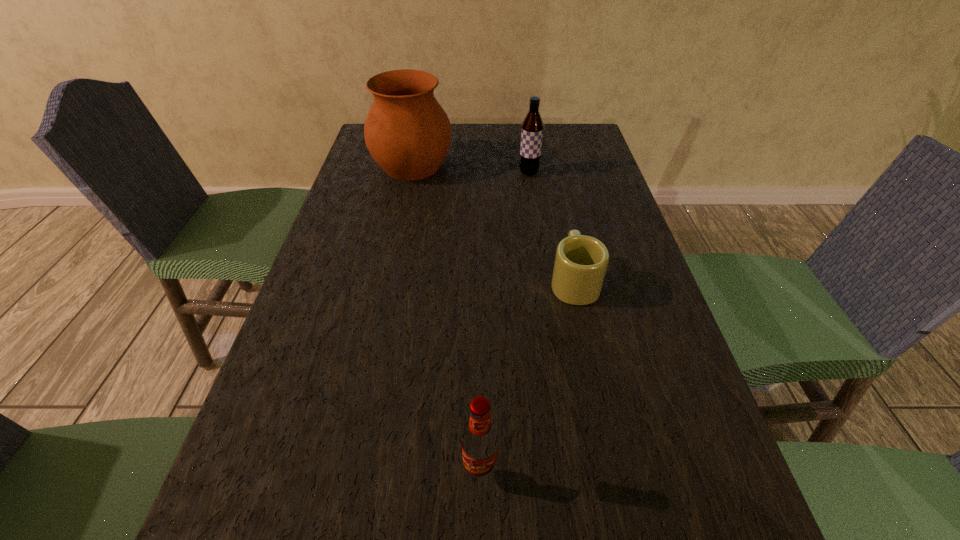
Where is `blank area located 0.050m with the handle on the side of the shortest object`? The image size is (960, 540). blank area located 0.050m with the handle on the side of the shortest object is located at coordinates (566, 245).

Identify the location of blank space located with the handle on the side of the shortest object. The height and width of the screenshot is (540, 960). (561, 220).

Where is `object present at the far edge`? This screenshot has height=540, width=960. object present at the far edge is located at coordinates (407, 132).

This screenshot has height=540, width=960. I want to click on object present at the left edge, so click(x=407, y=132).

Locate an element on the screen. The image size is (960, 540). object that is at the right edge is located at coordinates (581, 261).

Locate an element on the screen. The image size is (960, 540). object that is at the far left corner is located at coordinates (407, 132).

Identify the location of vacant space at the far edge of the desktop. (499, 152).

The height and width of the screenshot is (540, 960). Find the location of `vacant region at the left edge of the desktop`. vacant region at the left edge of the desktop is located at coordinates (351, 179).

At what (x,y) coordinates should I click in order to perform the action: click on blank space at the right edge of the desktop. Please return your answer as a coordinate pair (x, y). Image resolution: width=960 pixels, height=540 pixels. Looking at the image, I should click on pyautogui.click(x=619, y=214).

Locate an element on the screen. The height and width of the screenshot is (540, 960). vacant space at the far right corner is located at coordinates (574, 144).